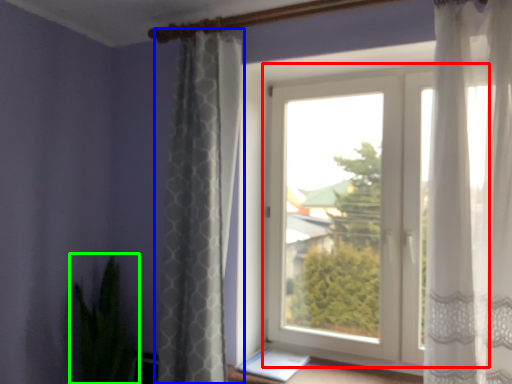
Question: Which object is the farthest from window (highlighted by a red box)? Choose among these: curtain (highlighted by a blue box) or houseplant (highlighted by a green box).

Choices:
 (A) curtain
 (B) houseplant

Answer: (B)